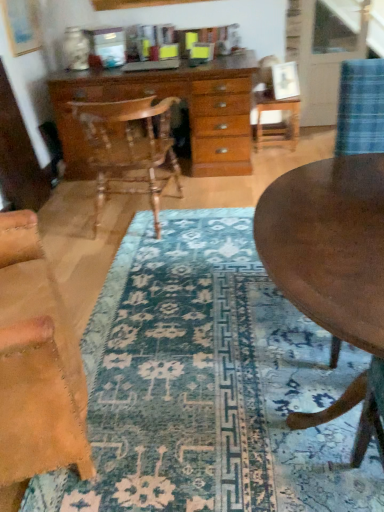
The image size is (384, 512). Find the location of `free space between wooden side table at center and wooden chest of drawers at center`. free space between wooden side table at center and wooden chest of drawers at center is located at coordinates (271, 161).